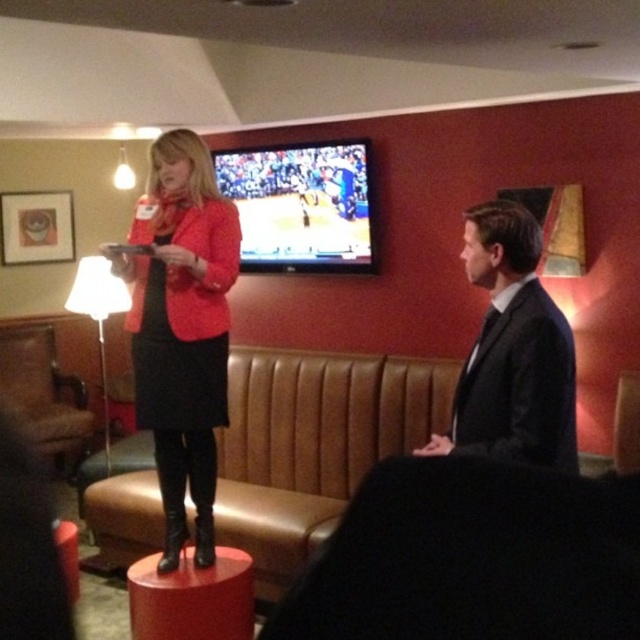
You are organizing a small event in the lounge and need to place a 1.2 meter wide table between the black suit at center and the brown leather armchair at left. Can the table fit between them based on their widths?

The black suit at center has a lesser width compared to brown leather armchair at left. Since the table is 1.2 meters wide, but the width between the two objects isn not specified, we cannot determine if the table will fit. Please provide more information about the distance between them.

You are a photographer setting up a shoot in the lounge. You want to position the camera so that it is exactly 8 feet away from the matte red blazer at center. Based on the scene description, can you achieve this distance?

The matte red blazer at center and camera are 7.70 feet apart, so you cannot achieve exactly 8 feet distance as it is slightly less than required.